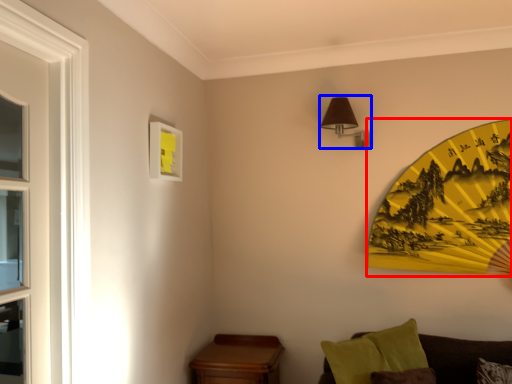
Question: Among these objects, which one is farthest to the camera, design (highlighted by a red box) or light fixture (highlighted by a blue box)?

Choices:
 (A) design
 (B) light fixture

Answer: (B)